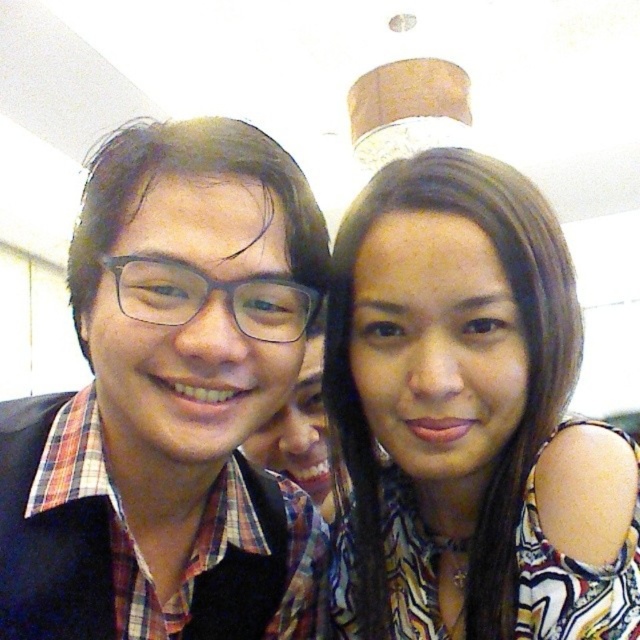
Question: Does plaid fabric shirt at left appear over multicolored printed blouse at center?

Choices:
 (A) no
 (B) yes

Answer: (B)

Question: Does plaid fabric shirt at left have a larger size compared to multicolored printed blouse at center?

Choices:
 (A) yes
 (B) no

Answer: (A)

Question: Which of the following is the closest to the observer?

Choices:
 (A) (22, 432)
 (B) (616, 448)

Answer: (B)

Question: Does plaid fabric shirt at left have a greater width compared to multicolored printed blouse at center?

Choices:
 (A) yes
 (B) no

Answer: (A)

Question: Which point is closer to the camera taking this photo?

Choices:
 (A) (120, 147)
 (B) (563, 464)

Answer: (B)